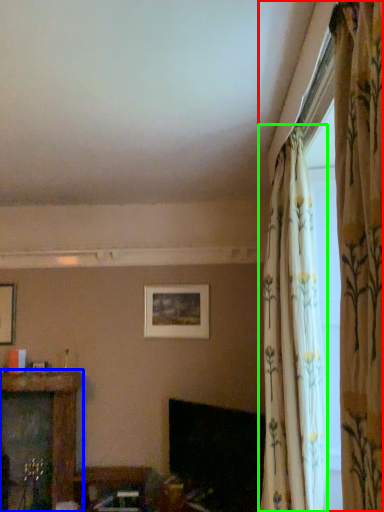
Question: Estimate the real-world distances between objects in this image. Which object is farther from curtain (highlighted by a red box), furniture (highlighted by a blue box) or curtain (highlighted by a green box)?

Choices:
 (A) furniture
 (B) curtain

Answer: (A)